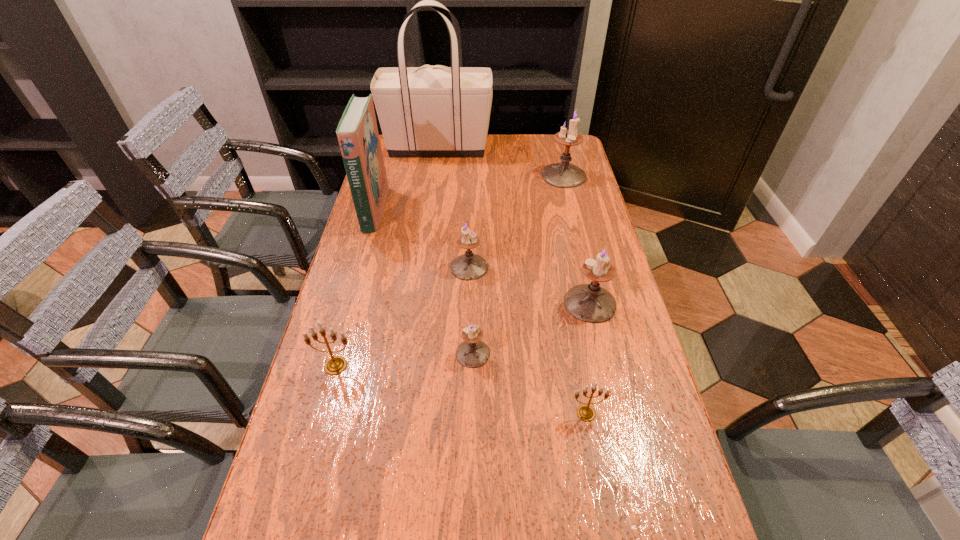
I want to click on vacant space at the left edge of the desktop, so click(x=407, y=222).

You are a GUI agent. You are given a task and a screenshot of the screen. Output one action in this format:
    pyautogui.click(x=<x>, y=<y>)
    Task: Click on the vacant space at the right edge
    This screenshot has width=960, height=540.
    Given the screenshot: What is the action you would take?
    pyautogui.click(x=624, y=449)

I want to click on free spot between the fifth nearest object and the farthest object, so click(x=453, y=207).

The image size is (960, 540). In order to click on free space between the third biggest purple candle holder and the nearest purple candle holder in this screenshot , I will do `click(471, 310)`.

At what (x,y) coordinates should I click in order to perform the action: click on free space between the seventh shortest object and the farther gold candelabrum. Please return your answer as a coordinate pair (x, y). This screenshot has height=540, width=960. Looking at the image, I should click on (355, 288).

You are a GUI agent. You are given a task and a screenshot of the screen. Output one action in this format:
    pyautogui.click(x=<x>, y=<y>)
    Task: Click on the free spot between the nearer gold candelabrum and the fifth nearest object
    
    Given the screenshot: What is the action you would take?
    pyautogui.click(x=528, y=340)

Where is `free spot between the nearest purple candle holder and the second tallest candelabrum`? The width and height of the screenshot is (960, 540). free spot between the nearest purple candle holder and the second tallest candelabrum is located at coordinates (532, 328).

This screenshot has width=960, height=540. What are the coordinates of `empty space that is in between the shopping bag and the nearest candelabrum` in the screenshot? It's located at (512, 280).

Locate an element on the screen. The height and width of the screenshot is (540, 960). empty location between the smallest purple candle holder and the nearest candelabrum is located at coordinates (529, 383).

I want to click on free space between the shopping bag and the hardback book, so click(x=406, y=179).